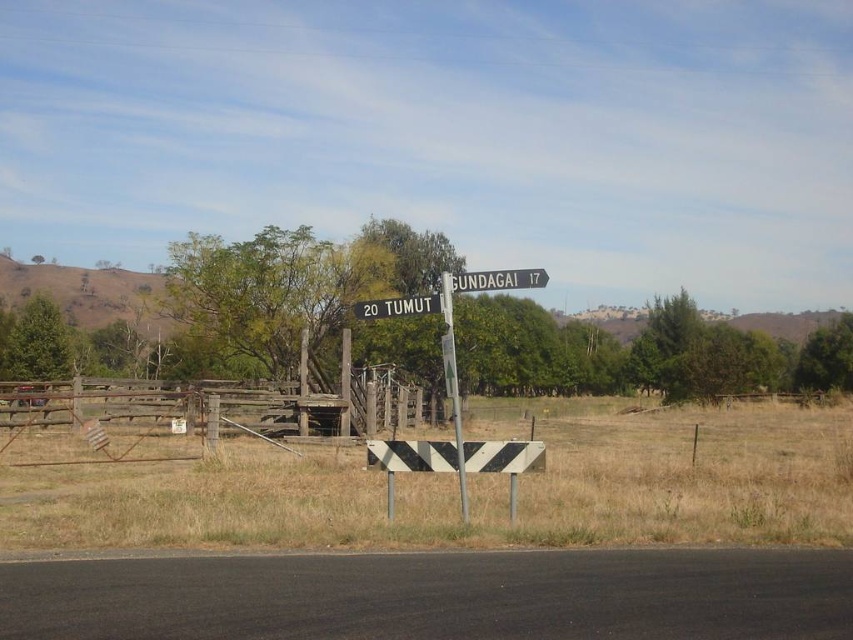
Where is `brown wooden fence at center`? The image size is (853, 640). brown wooden fence at center is located at coordinates (154, 419).

Between brown wooden fence at center and metallic pole at center, which one has more height?

With more height is metallic pole at center.

Who is more distant from viewer, [22,385] or [444,332]?

The point [22,385] is more distant.

Find the location of `brown wooden fence at center`. brown wooden fence at center is located at coordinates (154, 419).

Which of these two, metallic pole at center or black plastic sign at center, stands taller?

metallic pole at center is taller.

What do you see at coordinates (451, 385) in the screenshot?
I see `metallic pole at center` at bounding box center [451, 385].

Locate an element on the screen. This screenshot has height=640, width=853. metallic pole at center is located at coordinates (451, 385).

How much distance is there between brown wooden fence at center and black plastic sign at center?

15.33 meters

Can you confirm if brown wooden fence at center is positioned above black plastic sign at center?

Actually, brown wooden fence at center is below black plastic sign at center.

Locate an element on the screen. Image resolution: width=853 pixels, height=640 pixels. brown wooden fence at center is located at coordinates (154, 419).

This screenshot has width=853, height=640. Find the location of `brown wooden fence at center`. brown wooden fence at center is located at coordinates (154, 419).